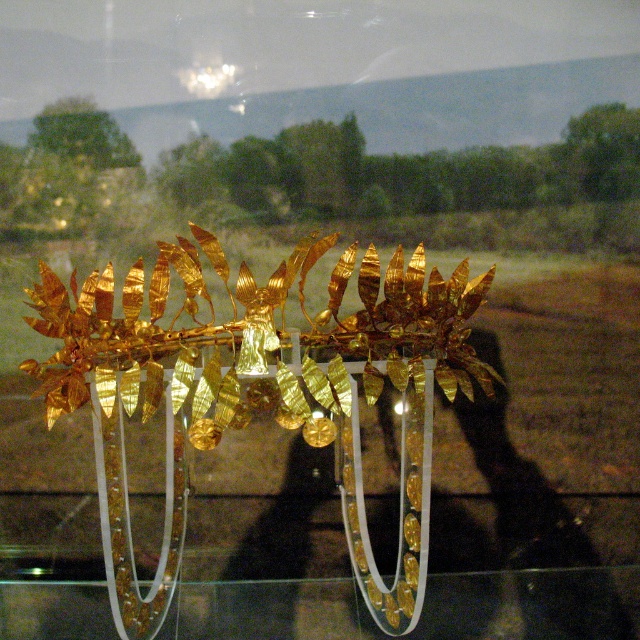
Question: Is gold leafy tiara at center closer to camera compared to transparent glass table at center?

Choices:
 (A) yes
 (B) no

Answer: (A)

Question: Which point appears farthest from the camera in this image?

Choices:
 (A) (131, 340)
 (B) (365, 634)

Answer: (B)

Question: Observing the image, what is the correct spatial positioning of gold leafy tiara at center in reference to transparent glass table at center?

Choices:
 (A) right
 (B) left

Answer: (B)

Question: Can you confirm if gold leafy tiara at center is bigger than transparent glass table at center?

Choices:
 (A) no
 (B) yes

Answer: (B)

Question: Among these points, which one is farthest from the camera?

Choices:
 (A) click(x=531, y=577)
 (B) click(x=198, y=228)

Answer: (A)